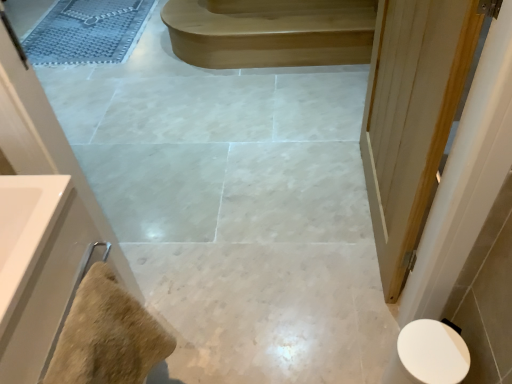
Measure the distance between point (x=110, y=286) and camera.

A distance of 70.60 centimeters exists between point (x=110, y=286) and camera.

What do you see at coordinates (433, 352) in the screenshot? I see `white glossy toilet at lower right` at bounding box center [433, 352].

Describe the element at coordinates (411, 117) in the screenshot. The height and width of the screenshot is (384, 512). I see `white wood door at right` at that location.

Describe the element at coordinates (25, 230) in the screenshot. I see `white glossy sink at left` at that location.

What are the coordinates of `textured gray bath mat at upper left` in the screenshot? It's located at (87, 32).

Who is taller, beige textured towel at lower left or light brown wood stair at upper center?

beige textured towel at lower left is taller.

Is beige textured towel at lower left oriented away from light brown wood stair at upper center?

No, beige textured towel at lower left is not facing the opposite direction of light brown wood stair at upper center.

From the image's perspective, is beige textured towel at lower left over light brown wood stair at upper center?

No, from the image's perspective, beige textured towel at lower left is not on top of light brown wood stair at upper center.

From the image's perspective, which one is positioned lower, white wood door at right or beige textured towel at lower left?

beige textured towel at lower left, from the image's perspective.

Is white wood door at right outside of beige textured towel at lower left?

Indeed, white wood door at right is completely outside beige textured towel at lower left.

From a real-world perspective, between white wood door at right and beige textured towel at lower left, who is vertically higher?

beige textured towel at lower left, from a real-world perspective.

Can you confirm if white wood door at right is taller than beige textured towel at lower left?

Correct, white wood door at right is much taller as beige textured towel at lower left.

Is white glossy toilet at lower right completely or partially outside of beige textured towel at lower left?

Yes, white glossy toilet at lower right is not within beige textured towel at lower left.

Does white glossy toilet at lower right come in front of beige textured towel at lower left?

No, it is behind beige textured towel at lower left.

How many degrees apart are the facing directions of white glossy toilet at lower right and beige textured towel at lower left?

The angle between the facing direction of white glossy toilet at lower right and the facing direction of beige textured towel at lower left is 131 degrees.

Which of these two, white glossy toilet at lower right or beige textured towel at lower left, is wider?

white glossy toilet at lower right is wider.

In the image, there is a beige textured towel at lower left. At what (x,y) coordinates should I click in order to perform the action: click on toilet below it (from the image's perspective). Please return your answer as a coordinate pair (x, y). The width and height of the screenshot is (512, 384). Looking at the image, I should click on (433, 352).

Is beige textured towel at lower left positioned before white glossy toilet at lower right?

Yes.

Between beige textured towel at lower left and white glossy toilet at lower right, which one has smaller size?

With smaller size is beige textured towel at lower left.

Can you confirm if textured gray bath mat at upper left is smaller than white glossy sink at left?

Actually, textured gray bath mat at upper left might be larger than white glossy sink at left.

Considering the sizes of textured gray bath mat at upper left and white glossy sink at left in the image, is textured gray bath mat at upper left wider or thinner than white glossy sink at left?

textured gray bath mat at upper left is wider than white glossy sink at left.

In the scene shown: How far apart are textured gray bath mat at upper left and white glossy sink at left?

textured gray bath mat at upper left and white glossy sink at left are 2.56 meters apart.

Are textured gray bath mat at upper left and white glossy sink at left beside each other?

There is a gap between textured gray bath mat at upper left and white glossy sink at left.

Are white wood door at right and white glossy toilet at lower right making contact?

They are not placed beside each other.

Is point (443, 2) positioned before point (406, 341)?

Yes, it is.

From the picture: Does white wood door at right have a lesser height compared to white glossy toilet at lower right?

No, white wood door at right is not shorter than white glossy toilet at lower right.

Consider the image. From the image's perspective, would you say white wood door at right is shown under white glossy toilet at lower right?

No, from the image's perspective, white wood door at right is not below white glossy toilet at lower right.

From a real-world perspective, does light brown wood stair at upper center sit lower than beige textured towel at lower left?

Correct, in the physical world, light brown wood stair at upper center is lower than beige textured towel at lower left.

Based on the photo, from the image's perspective, is light brown wood stair at upper center above or below beige textured towel at lower left?

Clearly, from the image's perspective, light brown wood stair at upper center is above beige textured towel at lower left.

Based on their positions, is light brown wood stair at upper center located to the left or right of beige textured towel at lower left?

light brown wood stair at upper center is to the right of beige textured towel at lower left.

The height and width of the screenshot is (384, 512). What are the coordinates of `stair lying on the right of beige textured towel at lower left` in the screenshot? It's located at (270, 32).

Identify the location of material lying in front of the white wood door at right. (106, 336).

In the scene shown: Based on their spatial positions, is light brown wood stair at upper center or white glossy toilet at lower right closer to textured gray bath mat at upper left?

The object closer to textured gray bath mat at upper left is light brown wood stair at upper center.

When comparing their distances from light brown wood stair at upper center, does textured gray bath mat at upper left or white wood door at right seem closer?

textured gray bath mat at upper left lies closer to light brown wood stair at upper center than the other object.

Looking at the image, which one is located further to beige textured towel at lower left, light brown wood stair at upper center or white wood door at right?

light brown wood stair at upper center.

Based on the photo, based on their spatial positions, is white wood door at right or textured gray bath mat at upper left closer to light brown wood stair at upper center?

Based on the image, textured gray bath mat at upper left appears to be nearer to light brown wood stair at upper center.

Looking at the image, which one is located closer to light brown wood stair at upper center, white glossy toilet at lower right or textured gray bath mat at upper left?

Among the two, textured gray bath mat at upper left is located nearer to light brown wood stair at upper center.

From the image, which object appears to be nearer to white glossy toilet at lower right, textured gray bath mat at upper left or beige textured towel at lower left?

beige textured towel at lower left is positioned closer to the anchor white glossy toilet at lower right.

Looking at the image, which one is located closer to white glossy toilet at lower right, textured gray bath mat at upper left or light brown wood stair at upper center?

Based on the image, light brown wood stair at upper center appears to be nearer to white glossy toilet at lower right.

Looking at this image, when comparing their distances from textured gray bath mat at upper left, does white glossy toilet at lower right or white glossy sink at left seem closer?

The object closer to textured gray bath mat at upper left is white glossy sink at left.

The height and width of the screenshot is (384, 512). In order to click on toilet located between beige textured towel at lower left and light brown wood stair at upper center in the depth direction in this screenshot , I will do `click(433, 352)`.

Locate an element on the screen. toilet located between white wood door at right and textured gray bath mat at upper left in the depth direction is located at coordinates (433, 352).

Identify the location of door located between beige textured towel at lower left and light brown wood stair at upper center in the depth direction. This screenshot has height=384, width=512. (411, 117).

Find the location of a particular element. door between white glossy sink at left and light brown wood stair at upper center from front to back is located at coordinates 411,117.